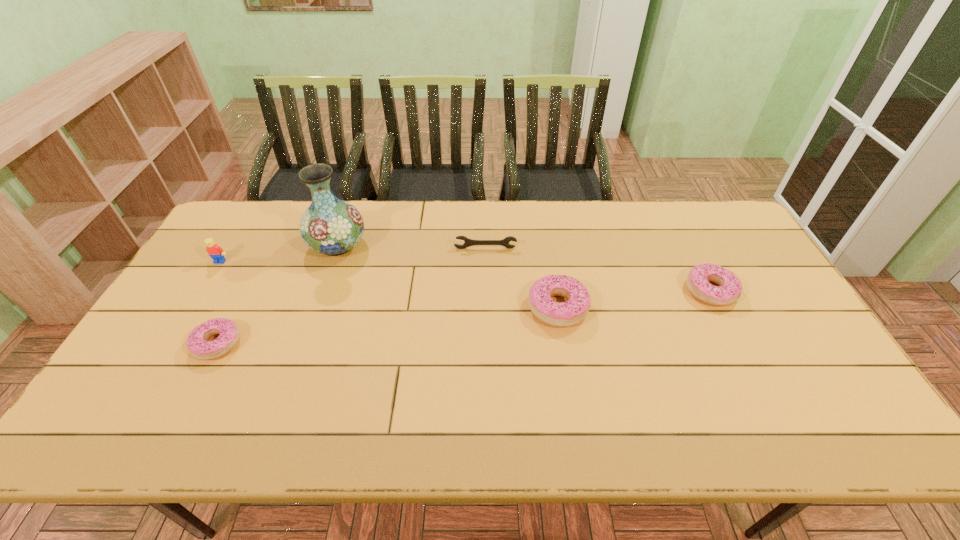
Please determine a free point for an extra doughnut to ensure balance. Please provide its 2D coordinates. Your answer should be formatted as a tuple, i.e. [(x, y)], where the tuple contains the x and y coordinates of a point satisfying the conditions above.

[(394, 325)]